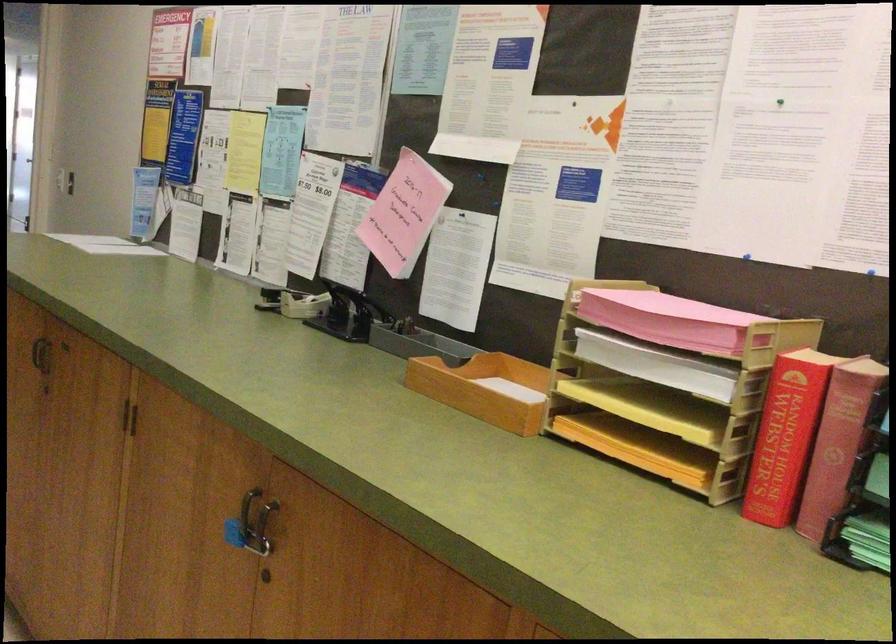
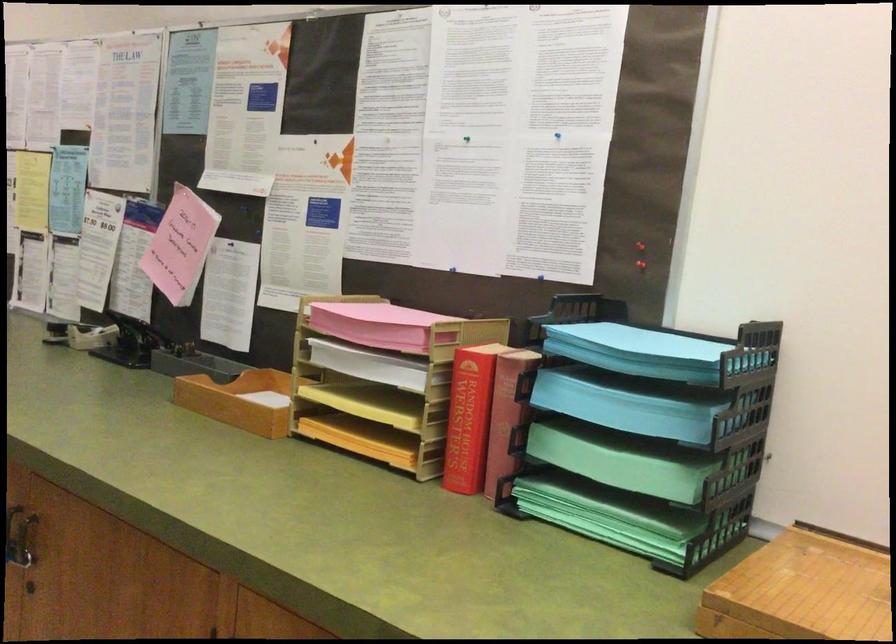
Where in the second image is the point corresponding to pixel 425 346 from the first image?

(202, 368)